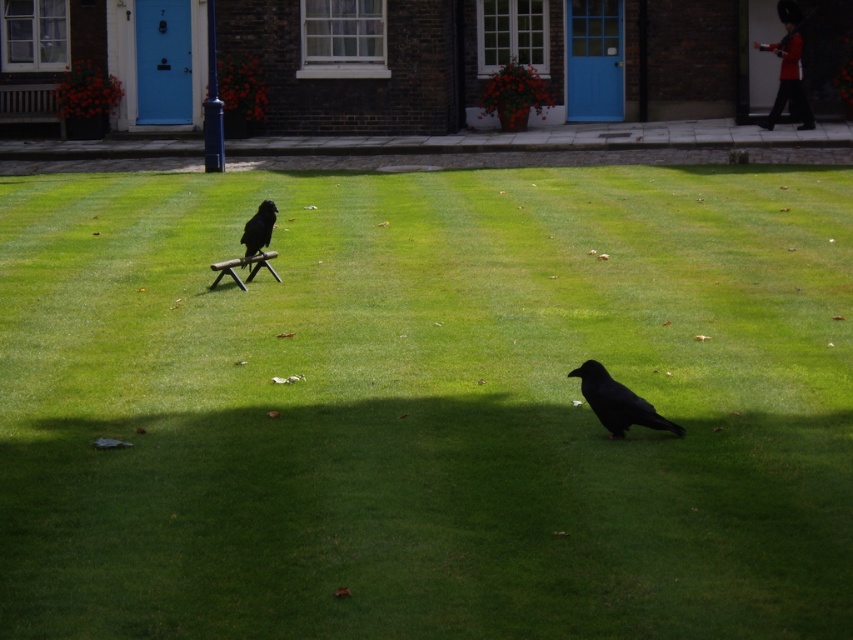
You are standing in front of the building and notice two birds. The shiny black crow at lower right and the black matte bird at center. Which bird is positioned closer to the right side of the scene?

The shiny black crow at lower right is positioned to the right of the black matte bird at center, so it is closer to the right side of the scene.

You are standing at the origin point of the coordinate system. A drone is flying above the scene. The drone needs to hover exactly at the position of the green grass at center. What are the coordinates where the drone should hover?

The drone should hover at coordinates point (x=426, y=404) to be exactly at the position of the green grass at center.